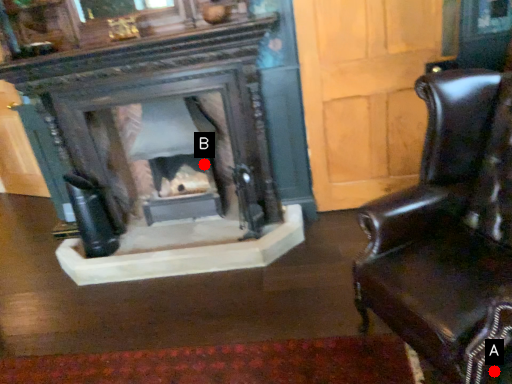
Question: Two points are circled on the image, labeled by A and B beside each circle. Which point appears farthest from the camera in this image?

Choices:
 (A) A is further
 (B) B is further

Answer: (B)